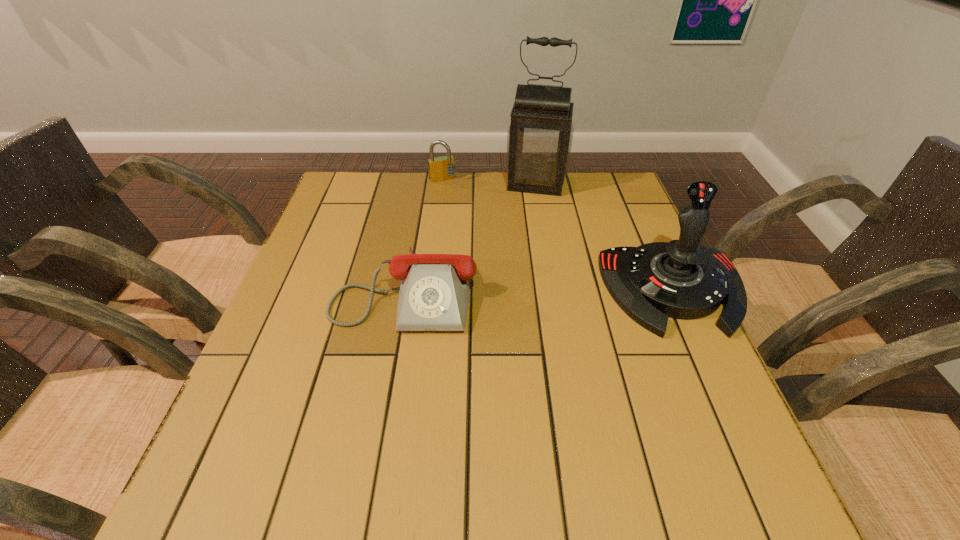
Locate an element on the screen. The width and height of the screenshot is (960, 540). vacant area that lies between the second tallest object and the telephone is located at coordinates (540, 289).

At what (x,y) coordinates should I click in order to perform the action: click on empty space that is in between the padlock and the shortest object. Please return your answer as a coordinate pair (x, y). Looking at the image, I should click on (424, 234).

Find the location of a particular element. Image resolution: width=960 pixels, height=540 pixels. free space that is in between the padlock and the joystick is located at coordinates point(558,235).

Find the location of a particular element. The width and height of the screenshot is (960, 540). free spot between the third shortest object and the third object from left to right is located at coordinates (605, 237).

You are a GUI agent. You are given a task and a screenshot of the screen. Output one action in this format:
    pyautogui.click(x=<x>, y=<y>)
    Task: Click on the free area in between the rightmost object and the lantern
    
    Given the screenshot: What is the action you would take?
    pyautogui.click(x=605, y=237)

Where is `free space between the telephone and the padlock`? free space between the telephone and the padlock is located at coordinates (424, 234).

The height and width of the screenshot is (540, 960). I want to click on object that is the second closest one to the second object from right to left, so click(683, 279).

Image resolution: width=960 pixels, height=540 pixels. What are the coordinates of `object that can be found as the second closest to the third shortest object` in the screenshot? It's located at (434, 293).

Locate an element on the screen. The height and width of the screenshot is (540, 960). vacant area in the image that satisfies the following two spatial constraints: 1. on the front side of the padlock; 2. on the right side of the second object from right to left is located at coordinates (442, 184).

Locate an element on the screen. The height and width of the screenshot is (540, 960). free space that satisfies the following two spatial constraints: 1. on the front side of the tallest object; 2. on the right side of the padlock is located at coordinates (442, 184).